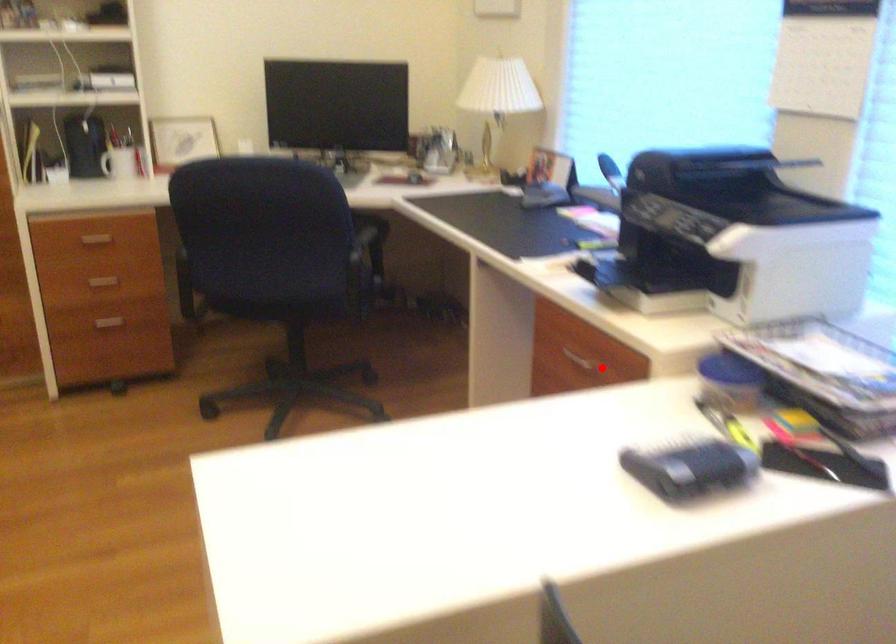
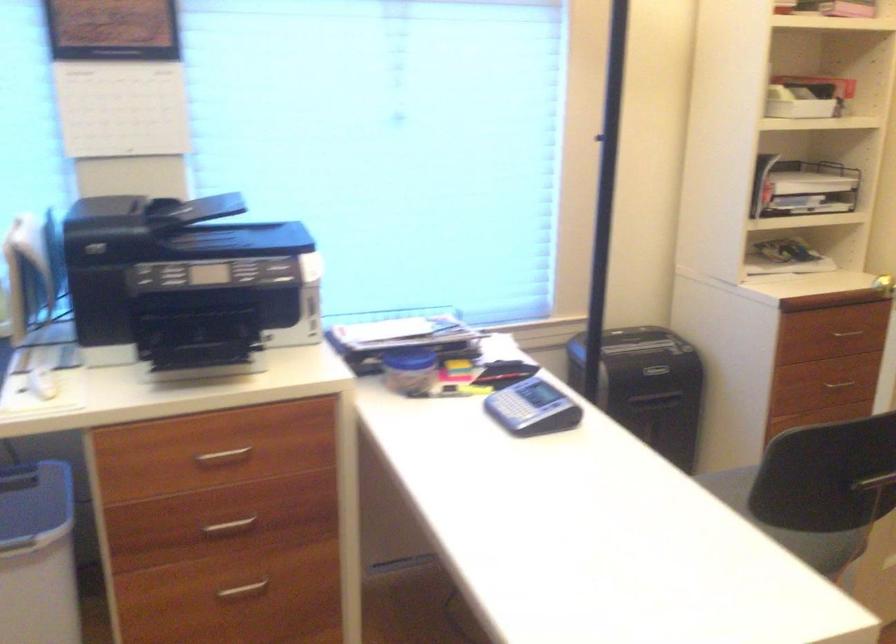
In the second image, find the point that corresponds to the highlighted location in the first image.

(222, 457)